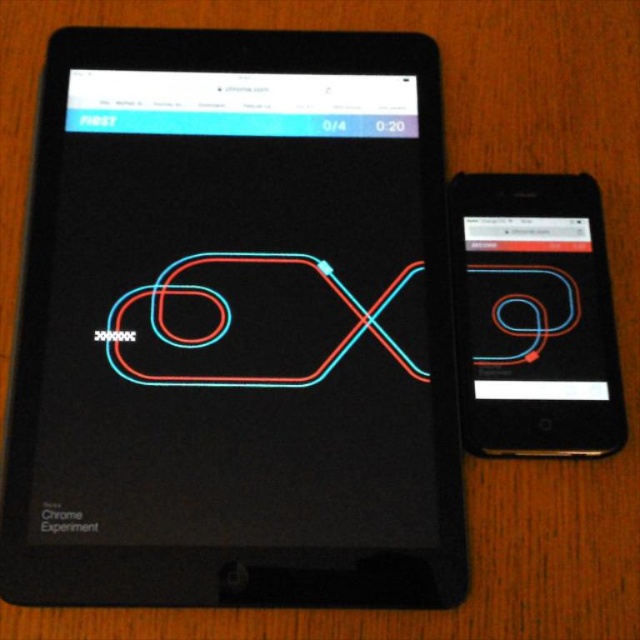
Question: Which of the following is the closest to the observer?

Choices:
 (A) matte black phone at right
 (B) black glossy tablet at upper left

Answer: (B)

Question: Does black glossy tablet at upper left have a smaller size compared to matte black phone at right?

Choices:
 (A) no
 (B) yes

Answer: (A)

Question: Is black glossy tablet at upper left to the left of matte black phone at right from the viewer's perspective?

Choices:
 (A) yes
 (B) no

Answer: (A)

Question: In this image, where is black glossy tablet at upper left located relative to matte black phone at right?

Choices:
 (A) below
 (B) above

Answer: (B)

Question: Which point is farther to the camera?

Choices:
 (A) (417, 205)
 (B) (577, 189)

Answer: (A)